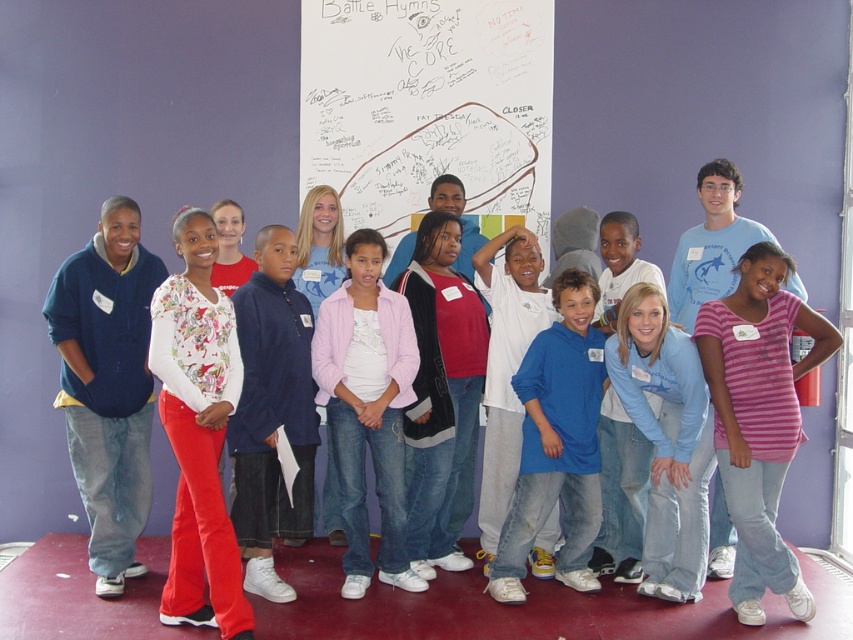
Is point (322, 17) more distant than point (550, 481)?

Yes.

Can you confirm if whiteboard at center is bigger than blue fleece jacket at center?

No, whiteboard at center is not bigger than blue fleece jacket at center.

Between point (399, 92) and point (566, 380), which one is positioned in front?

Point (566, 380)

Where is `whiteboard at center`? This screenshot has width=853, height=640. whiteboard at center is located at coordinates (428, 108).

Who is lower down, whiteboard at center or floral print blouse at center?

Positioned lower is floral print blouse at center.

The height and width of the screenshot is (640, 853). I want to click on whiteboard at center, so click(428, 108).

Is point (152, 316) in front of point (543, 332)?

Yes, point (152, 316) is in front of point (543, 332).

Does floral print blouse at center have a greater height compared to blue fleece jacket at center?

Indeed, floral print blouse at center has a greater height compared to blue fleece jacket at center.

Is point (200, 392) positioned behind point (549, 372)?

No, (200, 392) is closer to viewer.

You are a GUI agent. You are given a task and a screenshot of the screen. Output one action in this format:
    pyautogui.click(x=<x>, y=<y>)
    Task: Click on the floral print blouse at center
    
    Given the screenshot: What is the action you would take?
    pyautogui.click(x=198, y=432)